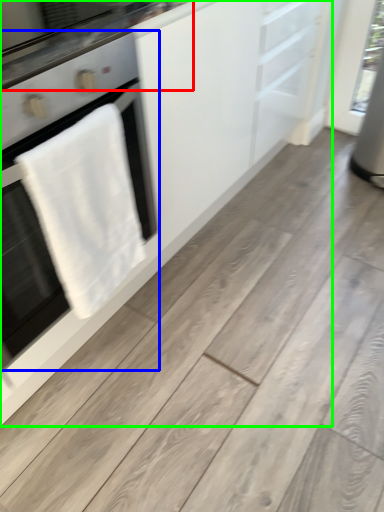
Question: Estimate the real-world distances between objects in this image. Which object is farther from countertop (highlighted by a red box), home appliance (highlighted by a blue box) or cabinetry (highlighted by a green box)?

Choices:
 (A) home appliance
 (B) cabinetry

Answer: (B)